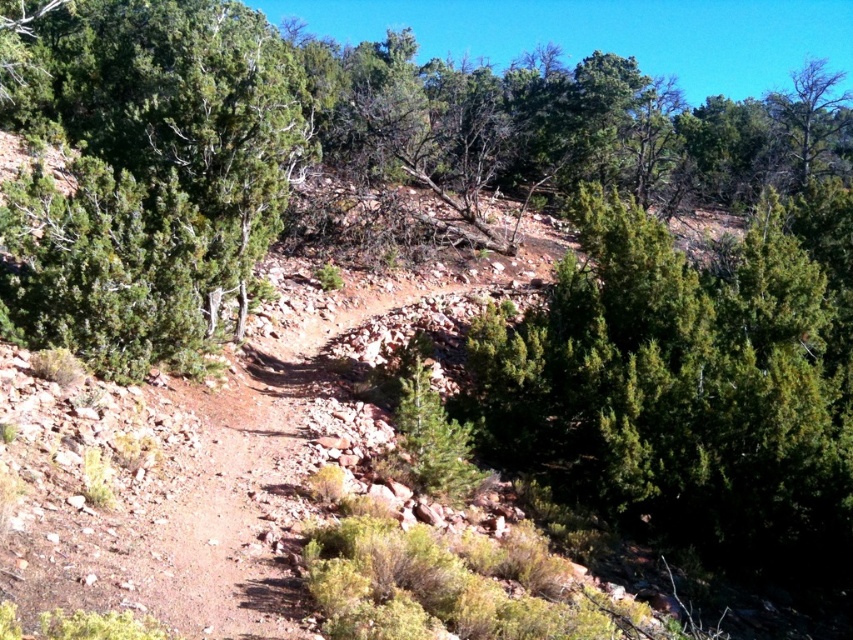
You are standing at the point marked as point (x=682, y=388) in the rugged landscape. You notice a green needle like object at the right side of this point. What is the nearest natural feature to your current position?

The nearest natural feature to point (x=682, y=388) is the green needle like object located at the right side of this point.